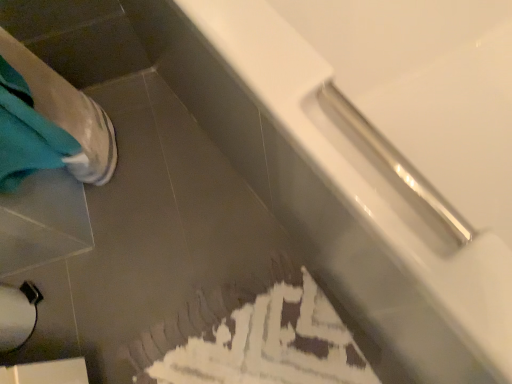
The image size is (512, 384). In order to click on white glossy bathtub at upper right in this screenshot , I will do `click(367, 205)`.

The image size is (512, 384). What do you see at coordinates (367, 205) in the screenshot?
I see `white glossy bathtub at upper right` at bounding box center [367, 205].

What is the approximate width of white glossy bathtub at upper right?

white glossy bathtub at upper right is 1.12 meters wide.

What do you see at coordinates (18, 314) in the screenshot? The image size is (512, 384). I see `white matte toilet paper at lower left` at bounding box center [18, 314].

The width and height of the screenshot is (512, 384). Find the location of `white matte toilet paper at lower left`. white matte toilet paper at lower left is located at coordinates (18, 314).

Where is `white glossy bathtub at upper right`? The image size is (512, 384). white glossy bathtub at upper right is located at coordinates (367, 205).

Considering the relative positions of white glossy bathtub at upper right and white matte toilet paper at lower left in the image provided, is white glossy bathtub at upper right to the left of white matte toilet paper at lower left from the viewer's perspective?

In fact, white glossy bathtub at upper right is to the right of white matte toilet paper at lower left.

Considering their positions, is white glossy bathtub at upper right located in front of or behind white matte toilet paper at lower left?

white glossy bathtub at upper right is positioned closer to the viewer than white matte toilet paper at lower left.

Which point is more distant from viewer, (x=321, y=102) or (x=26, y=308)?

Point (x=26, y=308)

From the image's perspective, which object appears higher, white glossy bathtub at upper right or white matte toilet paper at lower left?

white glossy bathtub at upper right is shown above in the image.

From a real-world perspective, is white glossy bathtub at upper right positioned above or below white matte toilet paper at lower left?

In terms of real-world spatial position, white glossy bathtub at upper right is above white matte toilet paper at lower left.

Can you confirm if white glossy bathtub at upper right is wider than white matte toilet paper at lower left?

Yes.

Does white glossy bathtub at upper right have a lesser height compared to white matte toilet paper at lower left?

Incorrect, the height of white glossy bathtub at upper right does not fall short of that of white matte toilet paper at lower left.

Between white glossy bathtub at upper right and white matte toilet paper at lower left, which one has larger size?

With larger size is white glossy bathtub at upper right.

Is white glossy bathtub at upper right not inside white matte toilet paper at lower left?

Yes, white glossy bathtub at upper right is not within white matte toilet paper at lower left.

Is there a large distance between white glossy bathtub at upper right and white matte toilet paper at lower left?

That's not correct — white glossy bathtub at upper right is a little close to white matte toilet paper at lower left.

Does white glossy bathtub at upper right turn towards white matte toilet paper at lower left?

No, white glossy bathtub at upper right does not turn towards white matte toilet paper at lower left.

Based on the photo, how different are the orientations of white glossy bathtub at upper right and white matte toilet paper at lower left in degrees?

The angle between the facing direction of white glossy bathtub at upper right and the facing direction of white matte toilet paper at lower left is 90.2 degrees.

This screenshot has height=384, width=512. Find the location of `toilet paper that appears below the white glossy bathtub at upper right (from a real-world perspective)`. toilet paper that appears below the white glossy bathtub at upper right (from a real-world perspective) is located at coordinates (18, 314).

In the image, is white matte toilet paper at lower left on the left side or the right side of white glossy bathtub at upper right?

white matte toilet paper at lower left is positioned on white glossy bathtub at upper right's left side.

Which object is closer to the camera taking this photo, white matte toilet paper at lower left or white glossy bathtub at upper right?

Positioned in front is white glossy bathtub at upper right.

Is point (6, 299) positioned before point (292, 88)?

No, (6, 299) is further to viewer.

From the image's perspective, is white matte toilet paper at lower left above or below white glossy bathtub at upper right?

Based on their image positions, white matte toilet paper at lower left is located beneath white glossy bathtub at upper right.

From a real-world perspective, is white matte toilet paper at lower left under white glossy bathtub at upper right?

Yes.

Between white matte toilet paper at lower left and white glossy bathtub at upper right, which one has smaller width?

white matte toilet paper at lower left is thinner.

Between white matte toilet paper at lower left and white glossy bathtub at upper right, which one has less height?

Standing shorter between the two is white matte toilet paper at lower left.

Is white matte toilet paper at lower left bigger or smaller than white glossy bathtub at upper right?

white matte toilet paper at lower left is smaller than white glossy bathtub at upper right.

Is white matte toilet paper at lower left inside the boundaries of white glossy bathtub at upper right, or outside?

white matte toilet paper at lower left is outside white glossy bathtub at upper right.

Is white matte toilet paper at lower left placed right next to white glossy bathtub at upper right?

No, white matte toilet paper at lower left is not with white glossy bathtub at upper right.

Could you tell me if white matte toilet paper at lower left is turned towards white glossy bathtub at upper right?

Yes, white matte toilet paper at lower left faces towards white glossy bathtub at upper right.

What's the angular difference between white matte toilet paper at lower left and white glossy bathtub at upper right's facing directions?

90.2 degrees separate the facing orientations of white matte toilet paper at lower left and white glossy bathtub at upper right.

Identify the location of bathtub in front of the white matte toilet paper at lower left. (367, 205).

At what (x,y) coordinates should I click in order to perform the action: click on bathtub that appears above the white matte toilet paper at lower left (from the image's perspective). Please return your answer as a coordinate pair (x, y). Looking at the image, I should click on (367, 205).

Locate an element on the screen. toilet paper on the left side of white glossy bathtub at upper right is located at coordinates (18, 314).